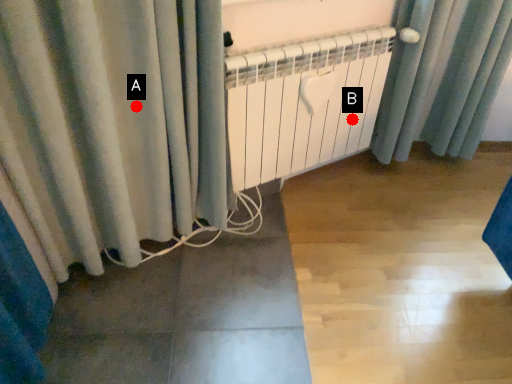
Question: Two points are circled on the image, labeled by A and B beside each circle. Which point appears closest to the camera in this image?

Choices:
 (A) A is closer
 (B) B is closer

Answer: (A)